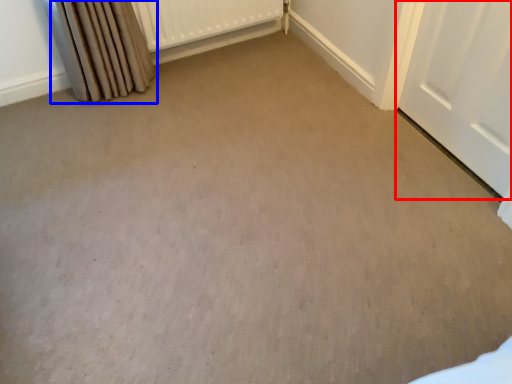
Question: Which point is further to the camera, door (highlighted by a red box) or curtain (highlighted by a blue box)?

Choices:
 (A) door
 (B) curtain

Answer: (B)